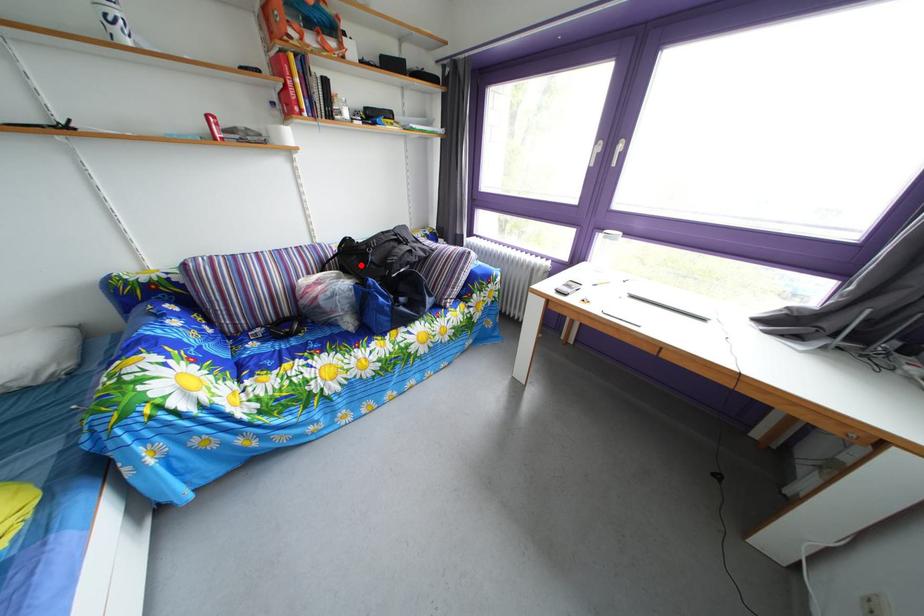
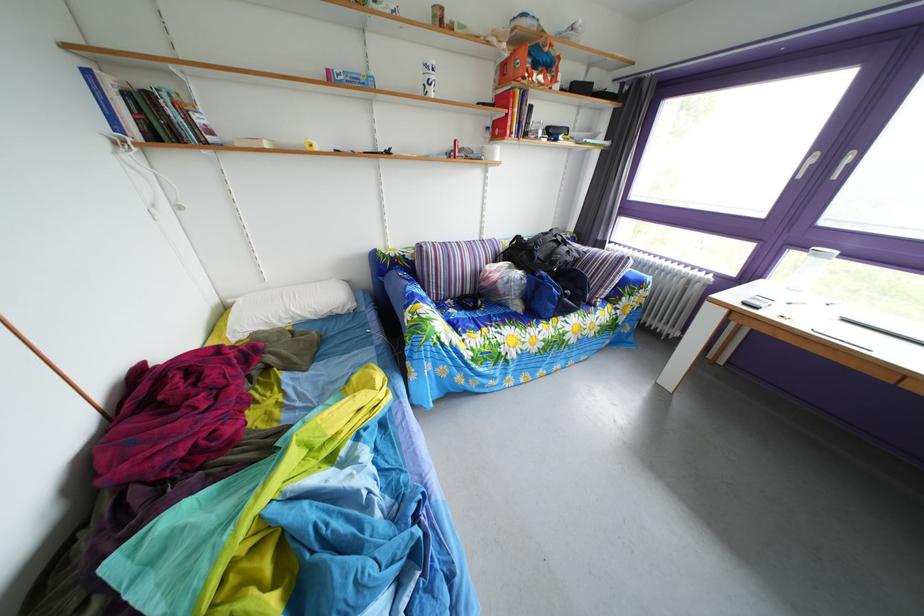
Find the pixel in the second image that matches the highlighted location in the first image.

(529, 261)